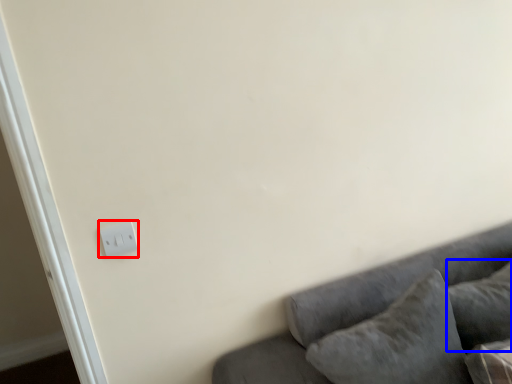
Question: Among these objects, which one is farthest to the camera, light switch (highlighted by a red box) or pillow (highlighted by a blue box)?

Choices:
 (A) light switch
 (B) pillow

Answer: (A)